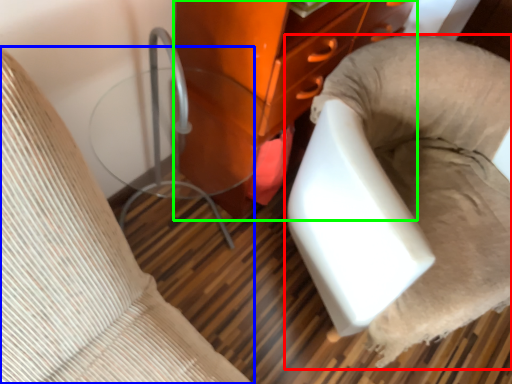
Question: Considering the real-world distances, which object is closest to furniture (highlighted by a red box)? furniture (highlighted by a blue box) or furniture (highlighted by a green box).

Choices:
 (A) furniture
 (B) furniture

Answer: (B)